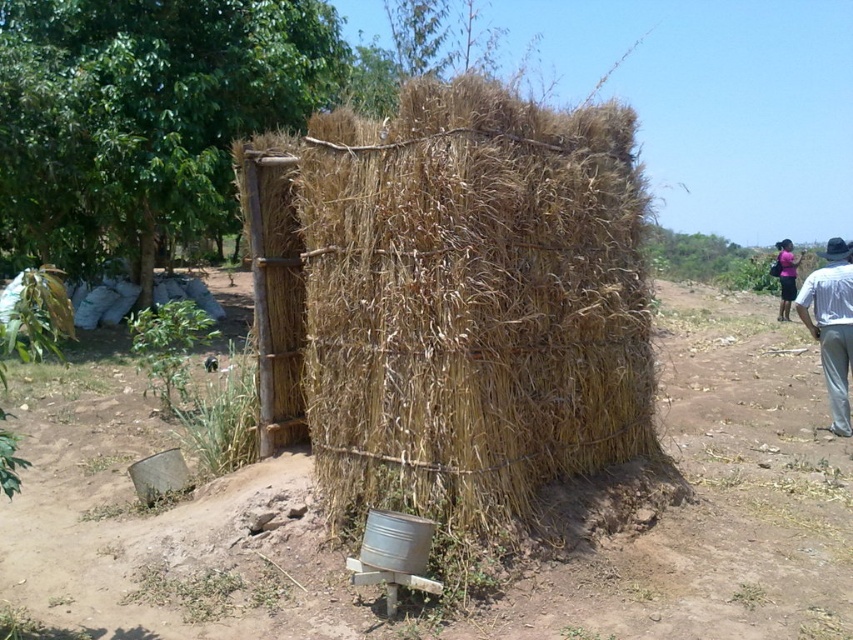
Question: Can you confirm if brown dirt field at center is thinner than white cotton shirt at right?

Choices:
 (A) yes
 (B) no

Answer: (B)

Question: Which of the following is the closest to the observer?

Choices:
 (A) (793, 292)
 (B) (27, 365)
 (C) (585, 132)
 (D) (833, 312)

Answer: (C)

Question: Is brown dirt field at center thinner than white cotton shirt at right?

Choices:
 (A) yes
 (B) no

Answer: (B)

Question: Is dry straw hut at center bigger than pink fabric dress at upper right?

Choices:
 (A) no
 (B) yes

Answer: (B)

Question: Based on their relative distances, which object is farther from the pink fabric dress at upper right?

Choices:
 (A) dry straw hut at center
 (B) brown dirt field at center

Answer: (A)

Question: Which of the following is the farthest from the observer?

Choices:
 (A) pink fabric dress at upper right
 (B) brown dirt field at center
 (C) dry straw hut at center
 (D) white cotton shirt at right

Answer: (A)